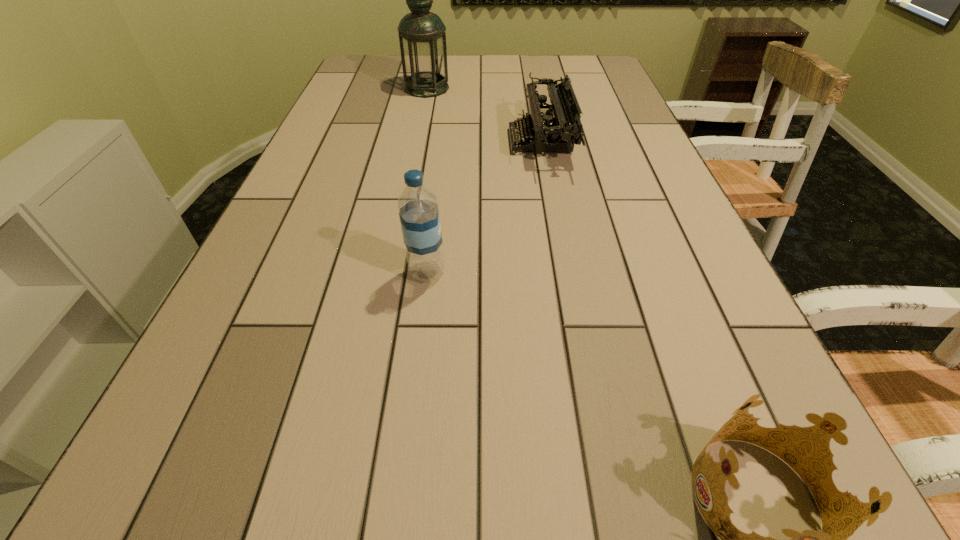
Locate an element on the screen. This screenshot has width=960, height=540. vacant area between the typewriter and the tallest object is located at coordinates (484, 114).

Point out which object is positioned as the second nearest to the third nearest object. Please provide its 2D coordinates. Your answer should be formatted as a tuple, i.e. [(x, y)], where the tuple contains the x and y coordinates of a point satisfying the conditions above.

[(418, 210)]

Identify the location of object that is the third closest one to the water bottle. This screenshot has width=960, height=540. (422, 37).